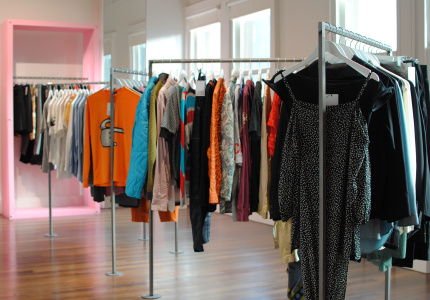
Identify the location of clothes rack. This screenshot has width=430, height=300. (232, 59), (321, 24), (151, 69), (112, 79), (80, 82).